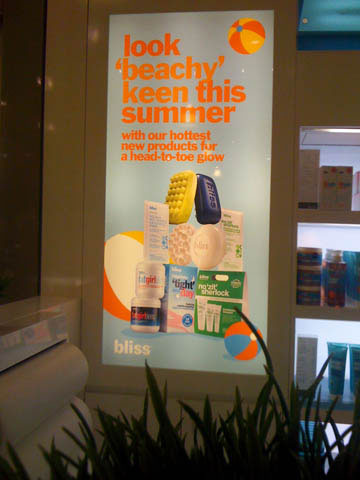
Identify the location of soap. (210, 237), (212, 195).